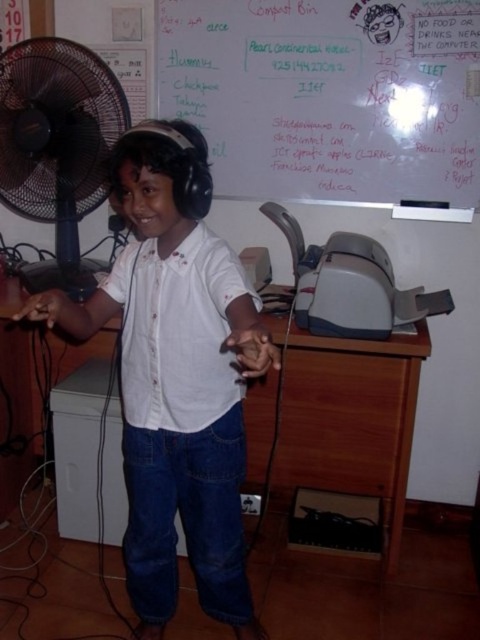
Question: Estimate the real-world distances between objects in this image. Which object is closer to the white matte shirt at center?

Choices:
 (A) wooden at center
 (B) whiteboard at upper center
 (C) black plastic fan at left

Answer: (A)

Question: Which of the following is the farthest from the observer?

Choices:
 (A) white matte shirt at center
 (B) black plastic fan at left
 (C) wooden at center

Answer: (B)

Question: Is white matte shirt at center bigger than black plastic fan at left?

Choices:
 (A) yes
 (B) no

Answer: (A)

Question: Is white matte shirt at center below black plastic fan at left?

Choices:
 (A) yes
 (B) no

Answer: (A)

Question: Which object appears closest to the camera in this image?

Choices:
 (A) black plastic fan at left
 (B) wooden at center

Answer: (B)

Question: Where is whiteboard at upper center located in relation to wooden at center in the image?

Choices:
 (A) below
 (B) above

Answer: (B)